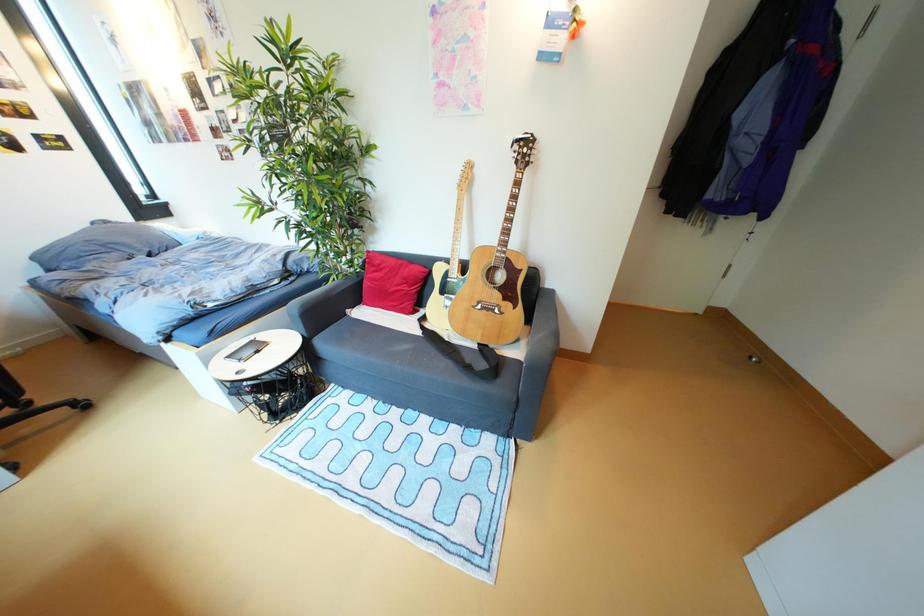
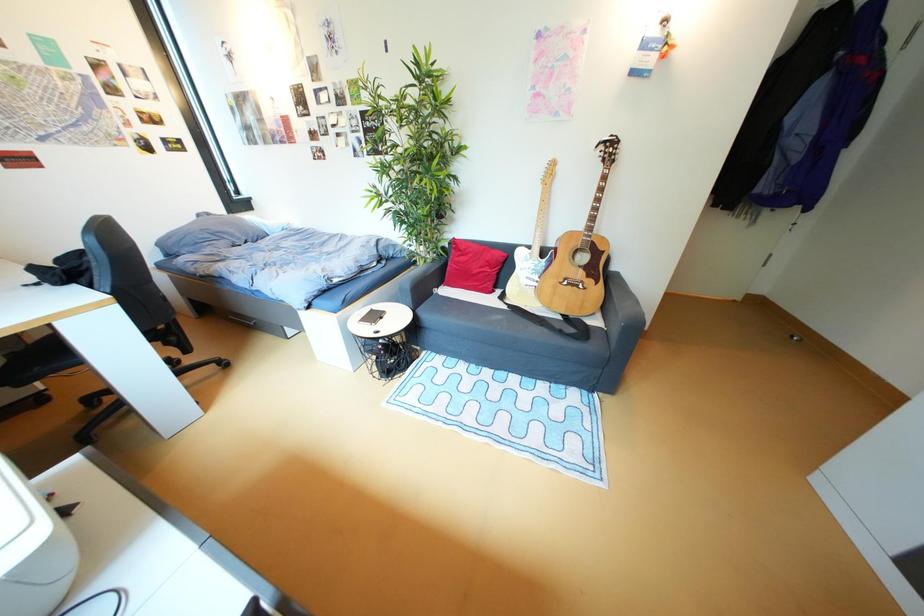
Question: The images are taken continuously from a first-person perspective. In which direction is your viewpoint rotating?

Choices:
 (A) Left
 (B) Right
 (C) Up
 (D) Down

Answer: (A)